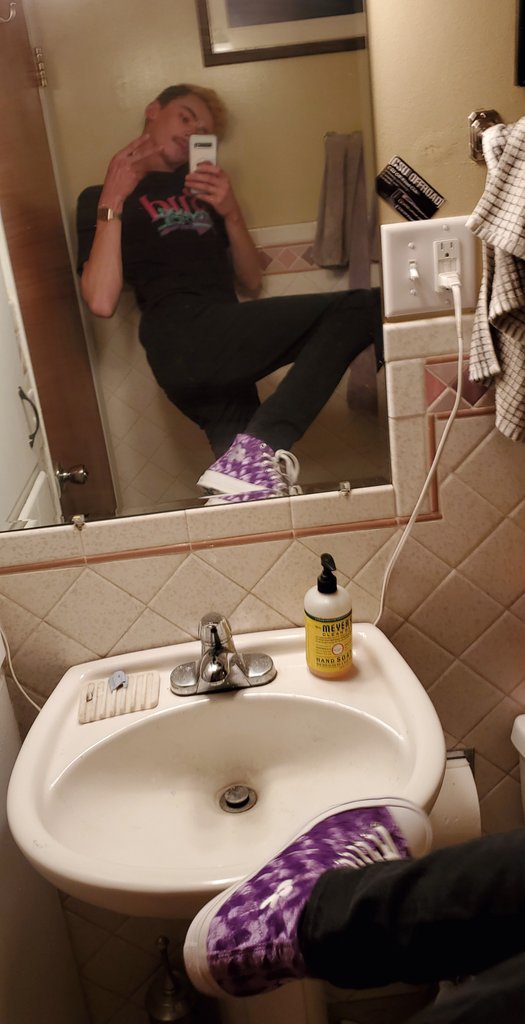
You are a GUI agent. You are given a task and a screenshot of the screen. Output one action in this format:
    pyautogui.click(x=<x>, y=<y>)
    Task: Click on the tile
    The width and height of the screenshot is (525, 1024).
    Given the screenshot: What is the action you would take?
    pyautogui.click(x=472, y=624)